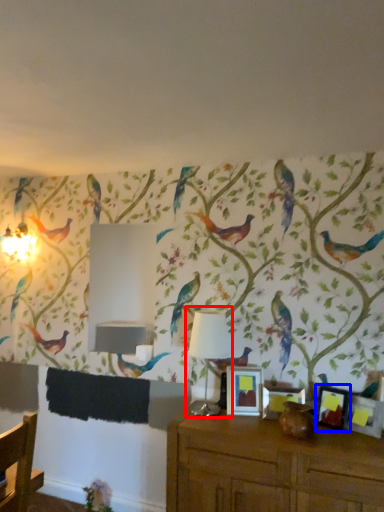
Question: Which object appears farthest to the camera in this image, table lamp (highlighted by a red box) or picture frame (highlighted by a blue box)?

Choices:
 (A) table lamp
 (B) picture frame

Answer: (A)